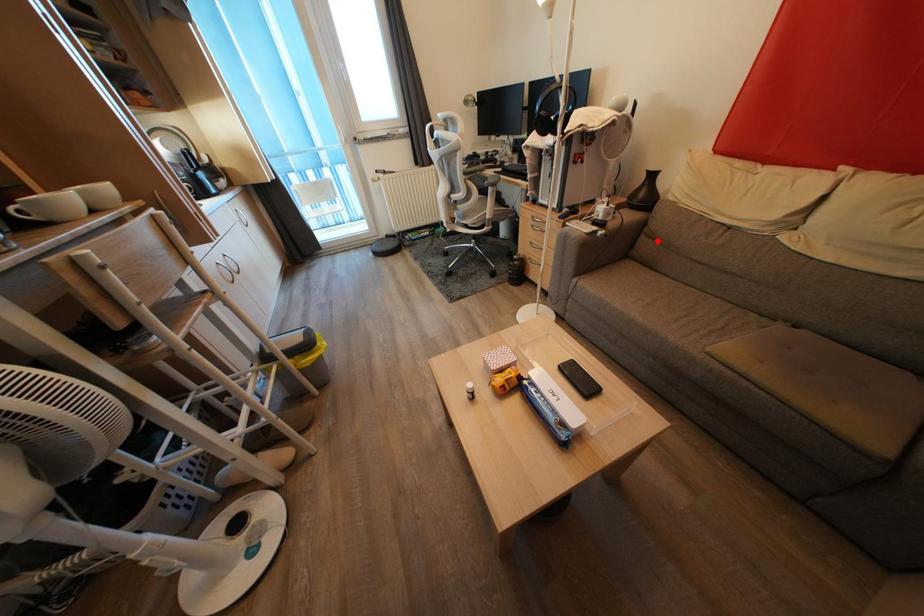
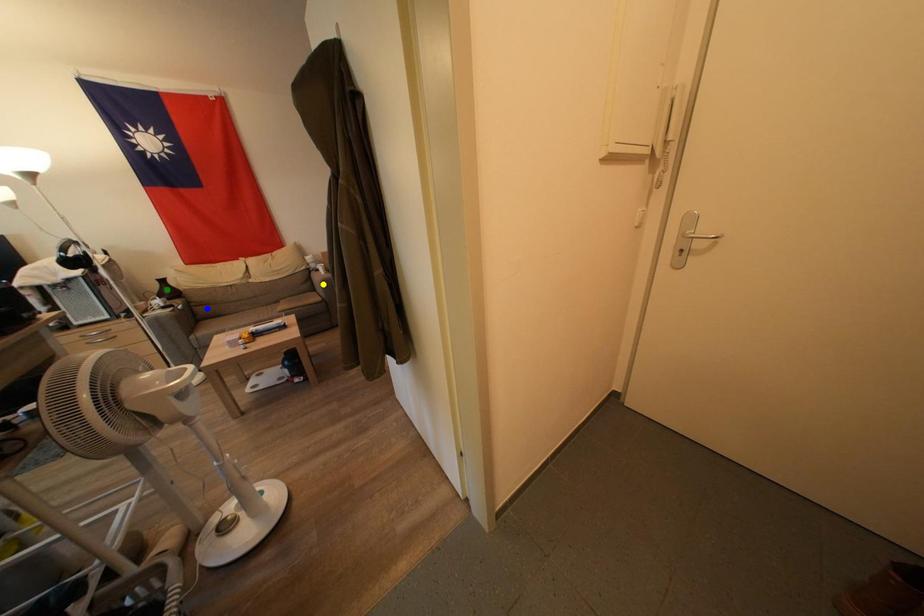
Question: I am providing you with two images of the same scene from different viewpoints. A red point is marked on the first image. You are given multiple points on the second image. Can you choose the point in image 2 that corresponds to the point in image 1?

Choices:
 (A) blue point
 (B) yellow point
 (C) green point

Answer: (A)